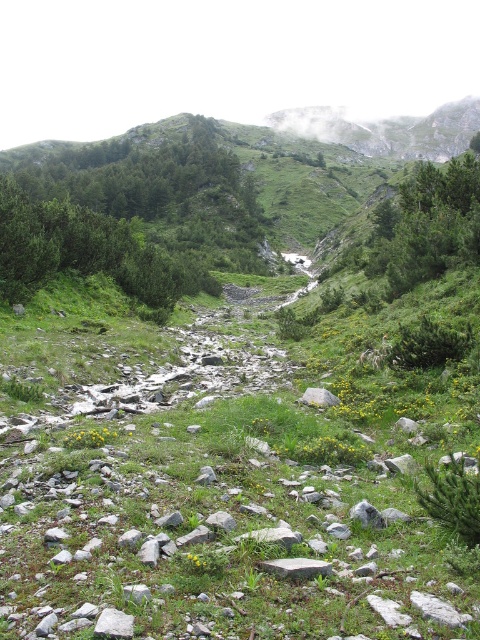
Question: Which point is closer to the camera taking this photo?

Choices:
 (A) (52, 248)
 (B) (132, 630)
 (C) (303, 572)

Answer: (B)

Question: Which point is farther to the camera?

Choices:
 (A) gray rock at center
 (B) green leafy shrubs at upper left

Answer: (B)

Question: Does green leafy shrubs at upper left appear on the left side of gray rock at center?

Choices:
 (A) no
 (B) yes

Answer: (B)

Question: Does gray granite rock at center have a lesser width compared to gray rock at center?

Choices:
 (A) no
 (B) yes

Answer: (B)

Question: Does gray rock at lower left come in front of gray rock at center?

Choices:
 (A) no
 (B) yes

Answer: (B)

Question: Which point is closer to the camera taking this photo?

Choices:
 (A) (110, 618)
 (B) (88, 220)
 (C) (274, 560)
 (D) (327, 390)

Answer: (A)